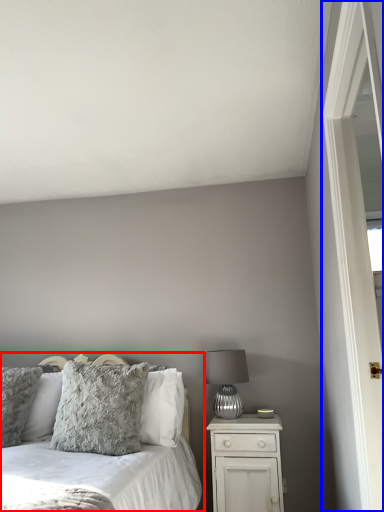
Question: Which object appears closest to the camera in this image, bed (highlighted by a red box) or screen door (highlighted by a blue box)?

Choices:
 (A) bed
 (B) screen door

Answer: (A)